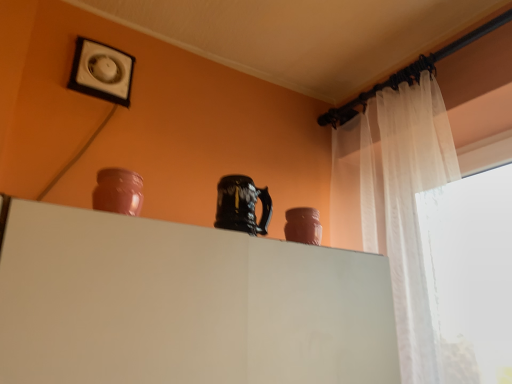
Describe the element at coordinates (241, 205) in the screenshot. I see `glossy ceramic mug at upper center` at that location.

This screenshot has width=512, height=384. What do you see at coordinates (118, 191) in the screenshot?
I see `matte clay vase at upper left, which appears as the second vase when viewed from the back` at bounding box center [118, 191].

In order to click on matte pink vase at right, which is the 2th vase in front-to-back order in this screenshot , I will do `click(303, 225)`.

This screenshot has height=384, width=512. In order to click on glossy ceramic mug at upper center in this screenshot , I will do `click(241, 205)`.

From a real-world perspective, which is physically above, matte pink vase at right, acting as the 2th vase starting from the top, or white glossy vent at upper left?

white glossy vent at upper left, from a real-world perspective.

Between matte pink vase at right, which is counted as the 1th vase, starting from the back, and white glossy vent at upper left, which one has smaller width?

white glossy vent at upper left is thinner.

Would you say matte pink vase at right, the 1th vase when ordered from right to left, contains white glossy vent at upper left?

That's incorrect, white glossy vent at upper left is not inside matte pink vase at right, the 1th vase when ordered from right to left.

Considering their positions, is matte pink vase at right, the 1th vase when ordered from right to left, located in front of or behind white glossy vent at upper left?

matte pink vase at right, the 1th vase when ordered from right to left, is positioned closer to the viewer than white glossy vent at upper left.

Is white glossy vent at upper left touching glossy ceramic mug at upper center?

No, white glossy vent at upper left is not touching glossy ceramic mug at upper center.

Is glossy ceramic mug at upper center completely or partially inside white glossy vent at upper left?

No, glossy ceramic mug at upper center is not a part of white glossy vent at upper left.

Can you confirm if white glossy vent at upper left is bigger than glossy ceramic mug at upper center?

Yes, white glossy vent at upper left is bigger than glossy ceramic mug at upper center.

Relative to glossy ceramic mug at upper center, is white glossy vent at upper left in front or behind?

white glossy vent at upper left is positioned farther from the viewer than glossy ceramic mug at upper center.

From a real-world perspective, between matte pink vase at right, arranged as the 1th vase when ordered from the bottom, and matte clay vase at upper left, arranged as the first vase when viewed from the top, who is vertically lower?

matte clay vase at upper left, arranged as the first vase when viewed from the top, from a real-world perspective.

Could you tell me if matte pink vase at right, acting as the 2th vase starting from the left, is facing matte clay vase at upper left, marked as the 2th vase in a bottom-to-top arrangement?

No, matte pink vase at right, acting as the 2th vase starting from the left, is not turned towards matte clay vase at upper left, marked as the 2th vase in a bottom-to-top arrangement.

Which point is more forward, [302,208] or [109,182]?

Point [109,182]

From the image's perspective, is white glossy vent at upper left under matte clay vase at upper left, arranged as the first vase when viewed from the top?

No, from the image's perspective, white glossy vent at upper left is not beneath matte clay vase at upper left, arranged as the first vase when viewed from the top.

Would you consider white glossy vent at upper left to be distant from matte clay vase at upper left, arranged as the first vase when viewed from the top?

They are positioned close to each other.

Is point (93, 69) farther from camera compared to point (113, 186)?

Yes, point (93, 69) is farther from viewer.

Which of these two, white glossy vent at upper left or matte clay vase at upper left, which appears as the second vase when viewed from the right, is bigger?

Bigger between the two is white glossy vent at upper left.

Is matte clay vase at upper left, arranged as the first vase when viewed from the top, to the left of matte pink vase at right, arranged as the 1th vase when ordered from the bottom, from the viewer's perspective?

Indeed, matte clay vase at upper left, arranged as the first vase when viewed from the top, is positioned on the left side of matte pink vase at right, arranged as the 1th vase when ordered from the bottom.

Could you tell me if matte clay vase at upper left, which ranks as the 1th vase in left-to-right order, is turned towards matte pink vase at right, acting as the 2th vase starting from the left?

No, matte clay vase at upper left, which ranks as the 1th vase in left-to-right order, is not oriented towards matte pink vase at right, acting as the 2th vase starting from the left.

Does matte clay vase at upper left, which appears as the second vase when viewed from the back, touch matte pink vase at right, acting as the 2th vase starting from the top?

No, matte clay vase at upper left, which appears as the second vase when viewed from the back, is not beside matte pink vase at right, acting as the 2th vase starting from the top.

How far apart are matte clay vase at upper left, the first vase when ordered from front to back, and matte pink vase at right, acting as the 2th vase starting from the left?

A distance of 15.22 inches exists between matte clay vase at upper left, the first vase when ordered from front to back, and matte pink vase at right, acting as the 2th vase starting from the left.

Which of these two, glossy ceramic mug at upper center or matte clay vase at upper left, which appears as the second vase when viewed from the right, stands shorter?

matte clay vase at upper left, which appears as the second vase when viewed from the right, is shorter.

Identify the location of vase that is above the glossy ceramic mug at upper center (from the image's perspective). (118, 191).

Is matte clay vase at upper left, arranged as the first vase when viewed from the top, a part of glossy ceramic mug at upper center?

No.

Between point (309, 226) and point (227, 192), which one is positioned behind?

Positioned behind is point (309, 226).

Looking at this image, considering the positions of objects matte pink vase at right, acting as the 2th vase starting from the left, and glossy ceramic mug at upper center in the image provided, who is more to the left, matte pink vase at right, acting as the 2th vase starting from the left, or glossy ceramic mug at upper center?

glossy ceramic mug at upper center is more to the left.

From their relative heights in the image, would you say matte pink vase at right, acting as the 2th vase starting from the top, is taller or shorter than glossy ceramic mug at upper center?

Considering their sizes, matte pink vase at right, acting as the 2th vase starting from the top, has less height than glossy ceramic mug at upper center.

Where is `picture frame that appears on the left of matte pink vase at right, acting as the 2th vase starting from the left`? picture frame that appears on the left of matte pink vase at right, acting as the 2th vase starting from the left is located at coordinates (102, 72).

The height and width of the screenshot is (384, 512). Find the location of `pottery below the white glossy vent at upper left (from a real-world perspective)`. pottery below the white glossy vent at upper left (from a real-world perspective) is located at coordinates (241, 205).

Estimate the real-world distances between objects in this image. Which object is closer to glossy ceramic mug at upper center, matte clay vase at upper left, arranged as the first vase when viewed from the top, or matte pink vase at right, which is counted as the 1th vase, starting from the back?

The object closer to glossy ceramic mug at upper center is matte pink vase at right, which is counted as the 1th vase, starting from the back.

Considering their positions, is matte pink vase at right, arranged as the 1th vase when ordered from the bottom, positioned closer to glossy ceramic mug at upper center than matte clay vase at upper left, arranged as the first vase when viewed from the top?

matte pink vase at right, arranged as the 1th vase when ordered from the bottom, is closer to glossy ceramic mug at upper center.

Which object lies further to the anchor point glossy ceramic mug at upper center, matte pink vase at right, which is the 2th vase in front-to-back order, or white glossy vent at upper left?

white glossy vent at upper left is further to glossy ceramic mug at upper center.

Looking at the image, which one is located further to matte pink vase at right, which is counted as the 1th vase, starting from the back, glossy ceramic mug at upper center or matte clay vase at upper left, the first vase when ordered from front to back?

Among the two, matte clay vase at upper left, the first vase when ordered from front to back, is located further to matte pink vase at right, which is counted as the 1th vase, starting from the back.

Looking at the image, which one is located further to matte clay vase at upper left, which appears as the second vase when viewed from the back, glossy ceramic mug at upper center or matte pink vase at right, arranged as the 1th vase when ordered from the bottom?

The object further to matte clay vase at upper left, which appears as the second vase when viewed from the back, is matte pink vase at right, arranged as the 1th vase when ordered from the bottom.

Which object lies further to the anchor point matte clay vase at upper left, arranged as the first vase when viewed from the top, matte pink vase at right, the 1th vase when ordered from right to left, or white glossy vent at upper left?

white glossy vent at upper left.

From the image, which object appears to be farther from matte clay vase at upper left, arranged as the first vase when viewed from the top, white glossy vent at upper left or matte pink vase at right, acting as the 2th vase starting from the left?

white glossy vent at upper left is further to matte clay vase at upper left, arranged as the first vase when viewed from the top.

When comparing their distances from glossy ceramic mug at upper center, does matte clay vase at upper left, which ranks as the 1th vase in left-to-right order, or white glossy vent at upper left seem further?

white glossy vent at upper left lies further to glossy ceramic mug at upper center than the other object.

The height and width of the screenshot is (384, 512). In order to click on pottery between white glossy vent at upper left and matte pink vase at right, the 1th vase when ordered from right to left, from left to right in this screenshot , I will do `click(241, 205)`.

Image resolution: width=512 pixels, height=384 pixels. Identify the location of vase between white glossy vent at upper left and matte pink vase at right, acting as the 2th vase starting from the left, in the horizontal direction. (118, 191).

Where is `pottery located between matte clay vase at upper left, the first vase when ordered from front to back, and white glossy vent at upper left in the depth direction`? This screenshot has width=512, height=384. pottery located between matte clay vase at upper left, the first vase when ordered from front to back, and white glossy vent at upper left in the depth direction is located at coordinates (241, 205).

Locate an element on the screen. pottery between matte clay vase at upper left, the first vase when ordered from front to back, and matte pink vase at right, arranged as the 1th vase when ordered from the bottom, in the horizontal direction is located at coordinates (241, 205).